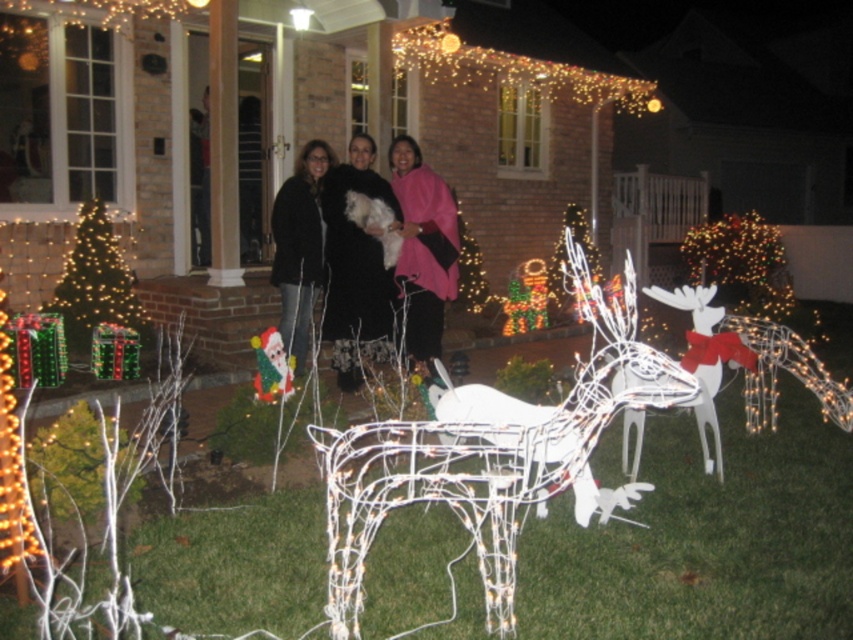
Question: Which of the following is the closest to the observer?

Choices:
 (A) pink fabric at center
 (B) black matte jacket at center
 (C) black fuzzy coat at center
 (D) green wire christmas tree at left

Answer: (B)

Question: Considering the relative positions of pink fabric at center and green wire christmas tree at left in the image provided, where is pink fabric at center located with respect to green wire christmas tree at left?

Choices:
 (A) left
 (B) right

Answer: (B)

Question: Is black fuzzy coat at center to the right of green wire christmas tree at left from the viewer's perspective?

Choices:
 (A) yes
 (B) no

Answer: (A)

Question: Which object is closer to the camera taking this photo?

Choices:
 (A) green wire christmas tree at left
 (B) pink fabric at center

Answer: (B)

Question: Does pink fabric at center have a larger size compared to black matte jacket at center?

Choices:
 (A) yes
 (B) no

Answer: (B)

Question: Which of these objects is positioned closest to the green wire christmas tree at left?

Choices:
 (A) black fuzzy coat at center
 (B) black matte jacket at center

Answer: (B)